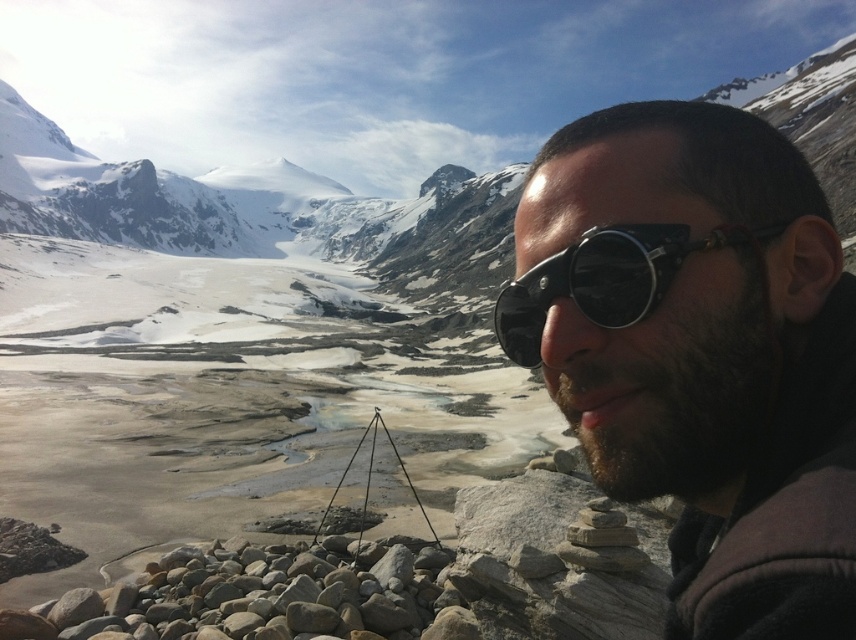
Question: Can you confirm if matte black sunglasses at center is wider than dark brown fuzzy beard at right?

Choices:
 (A) yes
 (B) no

Answer: (A)

Question: Which point is closer to the camera?

Choices:
 (A) matte black sunglasses at center
 (B) smooth gray rocks at lower left
 (C) black matte goggles at right
 (D) dark brown fuzzy beard at right

Answer: (A)

Question: Is matte black sunglasses at center closer to the viewer compared to smooth gray rocks at lower left?

Choices:
 (A) yes
 (B) no

Answer: (A)

Question: Is matte black sunglasses at center closer to camera compared to black matte goggles at right?

Choices:
 (A) yes
 (B) no

Answer: (A)

Question: Which object is farther from the camera taking this photo?

Choices:
 (A) matte black sunglasses at center
 (B) smooth gray rocks at lower left

Answer: (B)

Question: Which point is farther to the camera?

Choices:
 (A) black matte goggles at right
 (B) smooth gray rocks at lower left

Answer: (B)